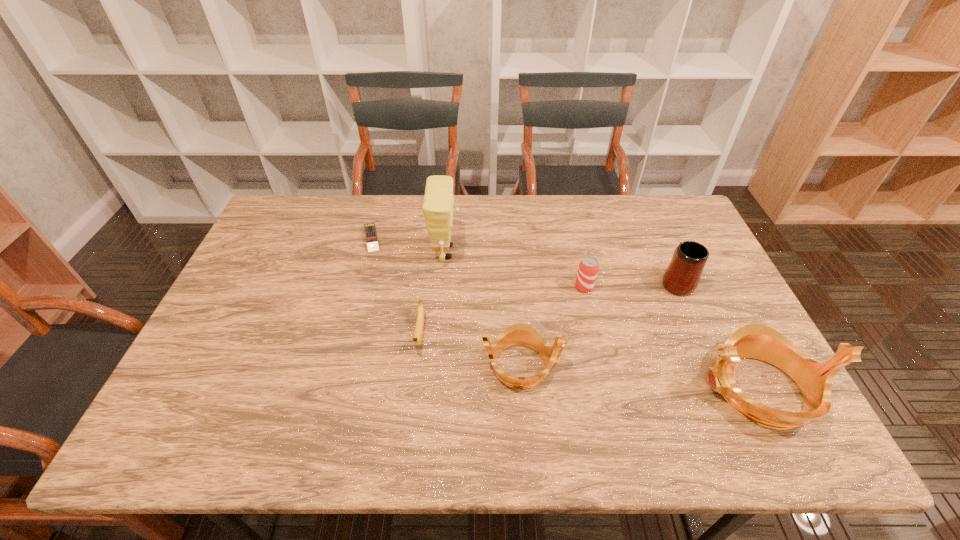
You are a GUI agent. You are given a task and a screenshot of the screen. Output one action in this format:
    pyautogui.click(x=<x>, y=<y>)
    Task: Click on the vacant space located at the stem of the sixth tallest object
    Image resolution: width=960 pixels, height=540 pixels.
    Given the screenshot: What is the action you would take?
    pyautogui.click(x=416, y=373)

Locate an element on the screen. remote control at the far edge is located at coordinates (371, 237).

Find the location of `sponge at the far edge`. sponge at the far edge is located at coordinates coord(437,207).

Locate an element on the screen. This screenshot has height=540, width=960. tiara that is positioned at the right edge is located at coordinates (757, 341).

Where is `mug that is at the right edge`? This screenshot has height=540, width=960. mug that is at the right edge is located at coordinates (682, 276).

At what (x,y) coordinates should I click in order to perform the action: click on object that is at the near right corner. Please return your answer as a coordinate pair (x, y). The image size is (960, 540). Looking at the image, I should click on (757, 341).

In the image, there is a desktop. At what (x,y) coordinates should I click in order to perform the action: click on free space at the far edge. Please return your answer as a coordinate pair (x, y). Looking at the image, I should click on (583, 200).

At what (x,y) coordinates should I click in order to perform the action: click on blank space at the left edge. Please return your answer as a coordinate pair (x, y). Image resolution: width=960 pixels, height=540 pixels. Looking at the image, I should click on (254, 266).

The image size is (960, 540). I want to click on blank space at the right edge, so click(661, 260).

Locate an element on the screen. Image resolution: width=960 pixels, height=540 pixels. vacant area at the far left corner of the desktop is located at coordinates (280, 200).